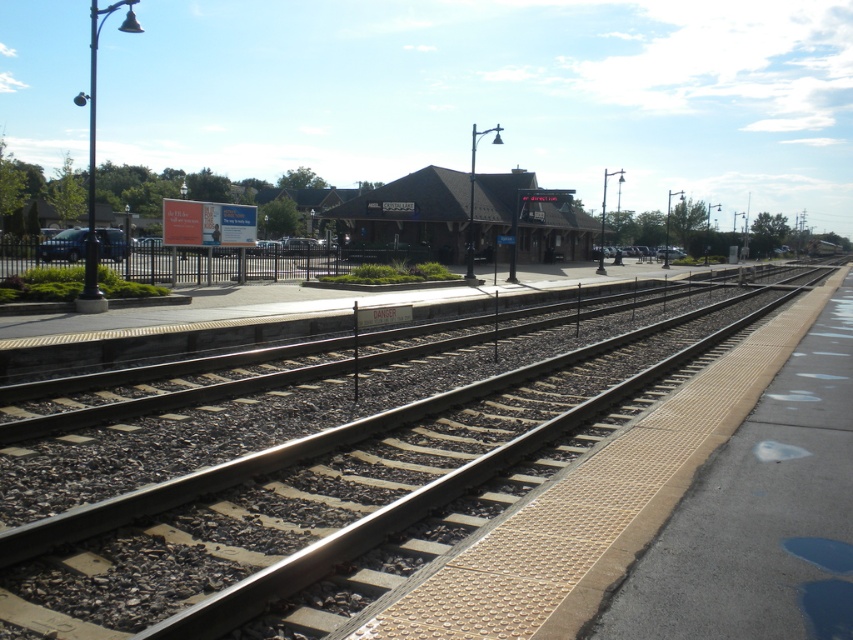
Is smooth asphalt track at center below brown wooden railway station at center?

Yes, smooth asphalt track at center is below brown wooden railway station at center.

I want to click on smooth asphalt track at center, so click(x=323, y=509).

Locate an element on the screen. The width and height of the screenshot is (853, 640). smooth asphalt track at center is located at coordinates (323, 509).